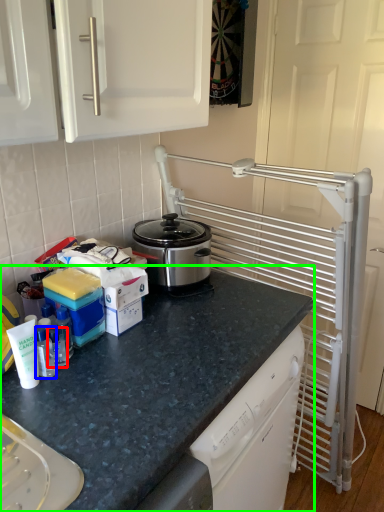
Question: Considering the real-world distances, which object is closest to bottle (highlighted by a red box)? bottle (highlighted by a blue box) or countertop (highlighted by a green box).

Choices:
 (A) bottle
 (B) countertop

Answer: (A)